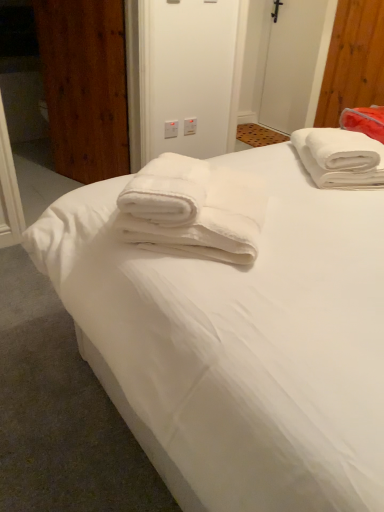
Describe the element at coordinates (194, 209) in the screenshot. I see `white fluffy towel at center, the 1th towel when ordered from front to back` at that location.

Locate an element on the screen. The image size is (384, 512). white fluffy towel at center, the second towel from the right is located at coordinates (194, 209).

Consider the image. What is the approximate width of white plastic electric outlet at upper center, which is counted as the first electric outlet, starting from the left?

The width of white plastic electric outlet at upper center, which is counted as the first electric outlet, starting from the left, is 0.85 inches.

Locate an element on the screen. The height and width of the screenshot is (512, 384). white plastic electric outlet at upper center, acting as the first electric outlet starting from the right is located at coordinates (190, 126).

Describe the element at coordinates (340, 158) in the screenshot. The image size is (384, 512). I see `white fluffy towel at upper right, arranged as the second towel when viewed from the front` at that location.

In order to face white plastic screen door at upper center, should I rotate leftwards or rightwards?

You should rotate right by 12.995 degrees.

This screenshot has height=512, width=384. I want to click on white plastic screen door at upper center, so click(x=296, y=64).

At what (x,y) coordinates should I click in order to perform the action: click on white soft towel at upper right. Please return your answer as a coordinate pair (x, y). The height and width of the screenshot is (512, 384). Looking at the image, I should click on [x=364, y=121].

Image resolution: width=384 pixels, height=512 pixels. I want to click on white soft towel at center, so click(241, 339).

Locate an element on the screen. This screenshot has width=384, height=512. white fluffy towel at center, marked as the 1th towel in a left-to-right arrangement is located at coordinates (194, 209).

Which object is positioned more to the right, white soft towel at upper right or white plastic electric outlet at upper center, acting as the 2th electric outlet starting from the left?

From the viewer's perspective, white soft towel at upper right appears more on the right side.

From the image's perspective, which object appears higher, white soft towel at upper right or white plastic electric outlet at upper center, acting as the 2th electric outlet starting from the left?

From the image's view, white plastic electric outlet at upper center, acting as the 2th electric outlet starting from the left, is above.

Does white fluffy towel at upper right, the 2th towel viewed from the left, turn towards white plastic electric outlet at upper center, which is counted as the first electric outlet, starting from the left?

No, white fluffy towel at upper right, the 2th towel viewed from the left, is not facing towards white plastic electric outlet at upper center, which is counted as the first electric outlet, starting from the left.

From the image's perspective, is white fluffy towel at upper right, the 2th towel viewed from the left, on white plastic electric outlet at upper center, which is counted as the first electric outlet, starting from the left?

Actually, white fluffy towel at upper right, the 2th towel viewed from the left, appears below white plastic electric outlet at upper center, which is counted as the first electric outlet, starting from the left, in the image.

Is white fluffy towel at upper right, the first towel in the back-to-front sequence, wider than white plastic electric outlet at upper center, which is the 2th electric outlet in right-to-left order?

Yes.

Is white fluffy towel at upper right, the first towel in the back-to-front sequence, beside white plastic electric outlet at upper center, which is counted as the first electric outlet, starting from the left?

white fluffy towel at upper right, the first towel in the back-to-front sequence, and white plastic electric outlet at upper center, which is counted as the first electric outlet, starting from the left, are not in contact.

In the image, there is a white soft towel at upper right. Identify the location of door above it (from the image's perspective). The width and height of the screenshot is (384, 512). pyautogui.click(x=85, y=86).

Which of these two, white soft towel at upper right or wooden door at left, is thinner?

wooden door at left.

Is point (371, 119) closer or farther from the camera than point (105, 156)?

Point (371, 119) is positioned closer to the camera compared to point (105, 156).

Considering the positions of objects white soft towel at upper right and wooden door at left in the image provided, who is more to the left, white soft towel at upper right or wooden door at left?

wooden door at left.

Is wooden door at left facing towards white fluffy towel at center, the 1th towel when ordered from front to back?

No, wooden door at left is not turned towards white fluffy towel at center, the 1th towel when ordered from front to back.

Can you confirm if wooden door at left is bigger than white fluffy towel at center, marked as the 1th towel in a left-to-right arrangement?

Indeed, wooden door at left has a larger size compared to white fluffy towel at center, marked as the 1th towel in a left-to-right arrangement.

Does point (103, 168) appear closer or farther from the camera than point (240, 205)?

Point (103, 168) is farther from the camera than point (240, 205).

Based on the photo, from the image's perspective, is white fluffy towel at upper right, arranged as the second towel when viewed from the front, located above wooden door at left?

No, from the image's perspective, white fluffy towel at upper right, arranged as the second towel when viewed from the front, is not over wooden door at left.

From a real-world perspective, is white fluffy towel at upper right, arranged as the second towel when viewed from the front, over wooden door at left?

Yes.

Measure the distance between white fluffy towel at upper right, the first towel in the back-to-front sequence, and wooden door at left.

4.80 feet.

Looking at their sizes, would you say white fluffy towel at upper right, marked as the 1th towel in a right-to-left arrangement, is wider or thinner than wooden door at left?

Considering their sizes, white fluffy towel at upper right, marked as the 1th towel in a right-to-left arrangement, looks broader than wooden door at left.

Which is behind, point (209, 217) or point (194, 132)?

Positioned behind is point (194, 132).

Is white fluffy towel at center, marked as the 1th towel in a left-to-right arrangement, to the right of white plastic electric outlet at upper center, acting as the first electric outlet starting from the right, from the viewer's perspective?

Correct, you'll find white fluffy towel at center, marked as the 1th towel in a left-to-right arrangement, to the right of white plastic electric outlet at upper center, acting as the first electric outlet starting from the right.

Looking at this image, from a real-world perspective, is white fluffy towel at center, which is counted as the second towel, starting from the back, over white plastic electric outlet at upper center, acting as the 2th electric outlet starting from the left?

Yes, from a real-world perspective, white fluffy towel at center, which is counted as the second towel, starting from the back, is above white plastic electric outlet at upper center, acting as the 2th electric outlet starting from the left.

Which towel is the 1st one when counting from the back of the white soft towel at center? Please provide its 2D coordinates.

[(194, 209)]

From the image's perspective, is white soft towel at center under white fluffy towel at center, marked as the 1th towel in a left-to-right arrangement?

Indeed, from the image's perspective, white soft towel at center is shown beneath white fluffy towel at center, marked as the 1th towel in a left-to-right arrangement.

Is white soft towel at center touching white fluffy towel at center, marked as the 1th towel in a left-to-right arrangement?

No, white soft towel at center is not touching white fluffy towel at center, marked as the 1th towel in a left-to-right arrangement.

In the scene shown: From a real-world perspective, relative to white fluffy towel at center, which is counted as the second towel, starting from the back, is white soft towel at center vertically above or below?

From a real-world perspective, white soft towel at center is physically below white fluffy towel at center, which is counted as the second towel, starting from the back.

Locate an element on the screen. The width and height of the screenshot is (384, 512). the 2nd electric outlet above the white soft towel at upper right (from the image's perspective) is located at coordinates (190, 126).

This screenshot has height=512, width=384. In order to click on the 2nd towel to the right when counting from the white plastic electric outlet at upper center, which is the 2th electric outlet in right-to-left order in this screenshot , I will do `click(340, 158)`.

Based on their spatial positions, is white plastic electric outlet at upper center, which is the 2th electric outlet in right-to-left order, or white soft towel at upper right further from white fluffy towel at upper right, the first towel in the back-to-front sequence?

Among the two, white plastic electric outlet at upper center, which is the 2th electric outlet in right-to-left order, is located further to white fluffy towel at upper right, the first towel in the back-to-front sequence.

From the picture: When comparing their distances from white fluffy towel at upper right, the first towel in the back-to-front sequence, does white fluffy towel at center, marked as the 1th towel in a left-to-right arrangement, or white plastic electric outlet at upper center, which is counted as the first electric outlet, starting from the left, seem further?

white plastic electric outlet at upper center, which is counted as the first electric outlet, starting from the left, is positioned further to the anchor white fluffy towel at upper right, the first towel in the back-to-front sequence.

From the picture: Based on their spatial positions, is white soft towel at center or white plastic electric outlet at upper center, which is counted as the first electric outlet, starting from the left, further from white plastic screen door at upper center?

white soft towel at center is positioned further to the anchor white plastic screen door at upper center.

From the image, which object appears to be farther from white soft towel at upper right, white fluffy towel at upper right, the 2th towel viewed from the left, or white soft towel at center?

white soft towel at center is positioned further to the anchor white soft towel at upper right.

Estimate the real-world distances between objects in this image. Which object is closer to white plastic screen door at upper center, white plastic electric outlet at upper center, acting as the first electric outlet starting from the right, or white plastic electric outlet at upper center, which is counted as the first electric outlet, starting from the left?

white plastic electric outlet at upper center, acting as the first electric outlet starting from the right, is positioned closer to the anchor white plastic screen door at upper center.

When comparing their distances from white soft towel at upper right, does white plastic screen door at upper center or white soft towel at center seem closer?

Based on the image, white soft towel at center appears to be nearer to white soft towel at upper right.

Which object lies nearer to the anchor point white plastic electric outlet at upper center, which is counted as the first electric outlet, starting from the left, white plastic screen door at upper center or white soft towel at upper right?

Based on the image, white soft towel at upper right appears to be nearer to white plastic electric outlet at upper center, which is counted as the first electric outlet, starting from the left.

Which object lies nearer to the anchor point white plastic electric outlet at upper center, which is counted as the first electric outlet, starting from the left, white plastic electric outlet at upper center, acting as the 2th electric outlet starting from the left, or wooden door at left?

Based on the image, white plastic electric outlet at upper center, acting as the 2th electric outlet starting from the left, appears to be nearer to white plastic electric outlet at upper center, which is counted as the first electric outlet, starting from the left.

At what (x,y) coordinates should I click in order to perform the action: click on cloth located between wooden door at left and white plastic screen door at upper center in the left-right direction. Please return your answer as a coordinate pair (x, y). Looking at the image, I should click on [x=364, y=121].

This screenshot has height=512, width=384. In order to click on electric outlet between white soft towel at center and white plastic electric outlet at upper center, acting as the 2th electric outlet starting from the left, along the z-axis in this screenshot , I will do `click(171, 129)`.

What are the coordinates of `cloth located between white fluffy towel at center, the second towel from the right, and white plastic electric outlet at upper center, which is counted as the first electric outlet, starting from the left, in the depth direction` in the screenshot? It's located at (364, 121).

This screenshot has height=512, width=384. In order to click on cloth between white soft towel at center and wooden door at left in the front-back direction in this screenshot , I will do `click(364, 121)`.